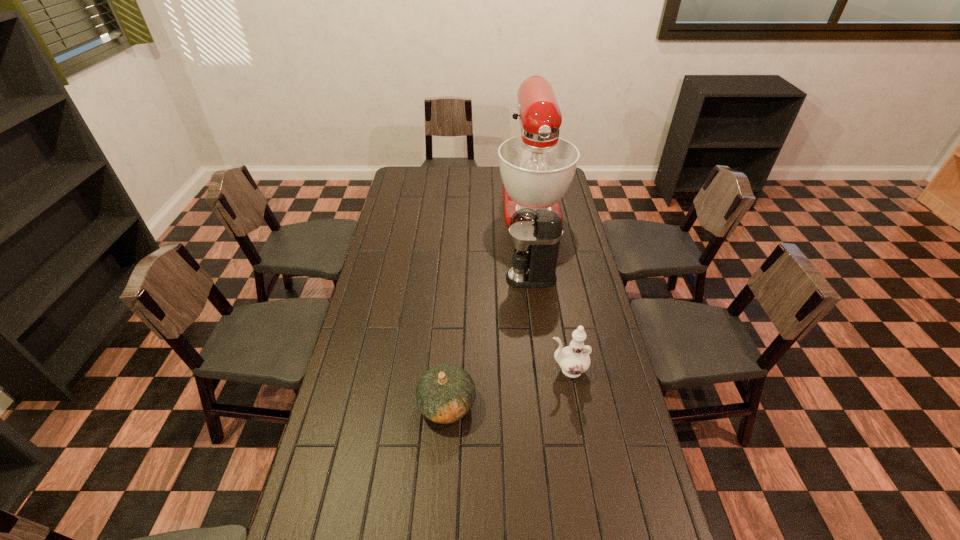
In the image, there is a desktop. At what (x,y) coordinates should I click in order to perform the action: click on free region at the far edge. Please return your answer as a coordinate pair (x, y). This screenshot has height=540, width=960. Looking at the image, I should click on (480, 179).

The image size is (960, 540). In the image, there is a desktop. In order to click on vacant space at the left edge in this screenshot , I will do `click(396, 269)`.

Where is `blank space at the right edge of the desktop`? blank space at the right edge of the desktop is located at coordinates (587, 374).

You are a GUI agent. You are given a task and a screenshot of the screen. Output one action in this format:
    pyautogui.click(x=<x>, y=<y>)
    Task: Click on the free space between the tallest object and the leftmost object
    Image resolution: width=960 pixels, height=540 pixels.
    Given the screenshot: What is the action you would take?
    pyautogui.click(x=489, y=304)

The width and height of the screenshot is (960, 540). Find the location of `free spot between the chinaware and the gourd`. free spot between the chinaware and the gourd is located at coordinates (507, 387).

Find the location of a particular element. This screenshot has width=960, height=540. free area in between the farthest object and the gourd is located at coordinates (489, 304).

This screenshot has height=540, width=960. I want to click on free spot between the coffee maker and the third tallest object, so click(x=549, y=323).

Locate an element on the screen. This screenshot has width=960, height=540. free spot between the chinaware and the coffee maker is located at coordinates (549, 323).

This screenshot has height=540, width=960. What are the coordinates of `vacant region between the second farthest object and the gourd` in the screenshot? It's located at (489, 341).

Locate an element on the screen. This screenshot has height=540, width=960. the second closest object relative to the third tallest object is located at coordinates (535, 234).